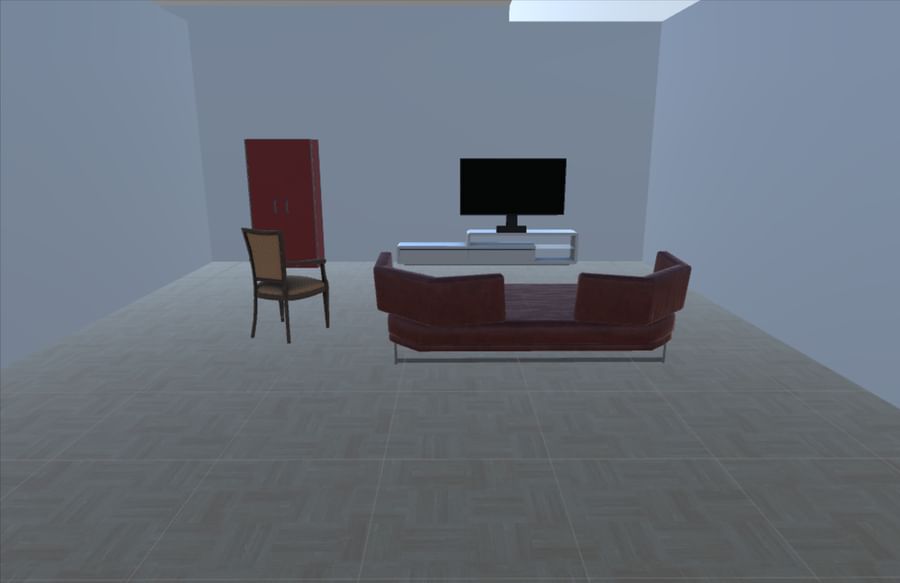
You are a GUI agent. You are given a task and a screenshot of the screen. Output one action in this format:
    pyautogui.click(x=<x>, y=<y>)
    Task: Click on the red cabinet
    This screenshot has height=583, width=900.
    Given the screenshot: What is the action you would take?
    pyautogui.click(x=295, y=215)